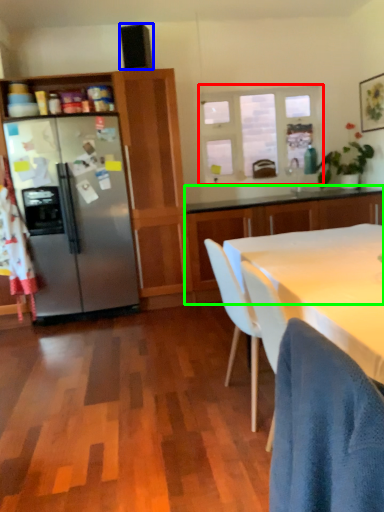
Question: Which object is positioned closest to window (highlighted by a red box)? Select from loudspeaker (highlighted by a blue box) and cabinetry (highlighted by a green box).

Choices:
 (A) loudspeaker
 (B) cabinetry

Answer: (B)